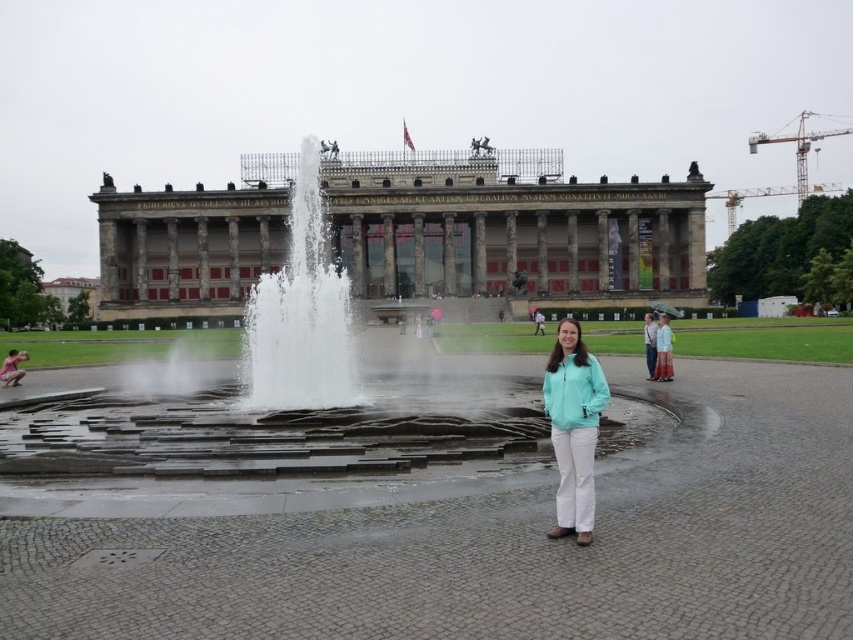
Measure the distance between white stone fountain at center and camera.

white stone fountain at center and camera are 360.72 feet apart from each other.

Does white stone fountain at center have a lesser width compared to teal fabric jacket at center?

No, white stone fountain at center is not thinner than teal fabric jacket at center.

Measure the distance between white stone fountain at center and camera.

The distance of white stone fountain at center from camera is 109.95 meters.

Locate an element on the screen. white stone fountain at center is located at coordinates click(x=300, y=314).

Between marble building at center and teal fabric jacket at center, which one appears on the right side from the viewer's perspective?

Positioned to the right is teal fabric jacket at center.

Who is taller, marble building at center or teal fabric jacket at center?

Standing taller between the two is marble building at center.

Identify the location of marble building at center. (514, 232).

Between marble building at center and white stone fountain at center, which one appears on the left side from the viewer's perspective?

From the viewer's perspective, white stone fountain at center appears more on the left side.

Can you confirm if marble building at center is thinner than white stone fountain at center?

No.

The width and height of the screenshot is (853, 640). What are the coordinates of `marble building at center` in the screenshot? It's located at (514, 232).